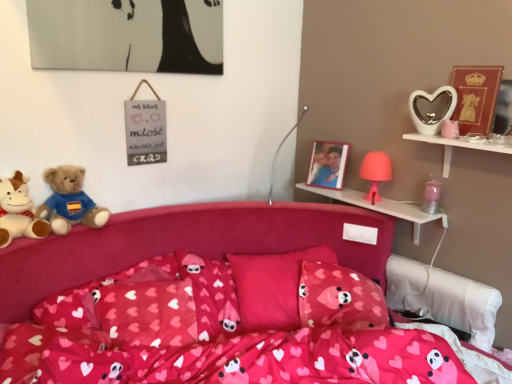
Question: Does matte gold picture frame at upper right, which is counted as the first picture frame, starting from the front, have a greater height compared to white glossy heart at upper right, the 3th toy ordered from the bottom?

Choices:
 (A) no
 (B) yes

Answer: (B)

Question: Could you tell me if matte gold picture frame at upper right, the first picture frame in the right-to-left sequence, is facing white glossy heart at upper right, the 3th toy ordered from the bottom?

Choices:
 (A) yes
 (B) no

Answer: (A)

Question: Would you say matte gold picture frame at upper right, arranged as the 2th picture frame when viewed from the left, contains white glossy heart at upper right, which is the second toy in top-to-bottom order?

Choices:
 (A) yes
 (B) no

Answer: (B)

Question: Is matte gold picture frame at upper right, arranged as the 2th picture frame when viewed from the left, located outside white glossy heart at upper right, the 3th toy ordered from the bottom?

Choices:
 (A) yes
 (B) no

Answer: (A)

Question: From the image's perspective, is matte gold picture frame at upper right, the first picture frame in the right-to-left sequence, on white glossy heart at upper right, the 3th toy ordered from the bottom?

Choices:
 (A) no
 (B) yes

Answer: (B)

Question: Does matte gold picture frame at upper right, arranged as the 2th picture frame when viewed from the left, have a lesser width compared to white glossy heart at upper right, the 3th toy ordered from the bottom?

Choices:
 (A) no
 (B) yes

Answer: (B)

Question: Does pink fabric bed at center appear on the right side of white glossy heart-shaped object at upper right, marked as the first shelf in a front-to-back arrangement?

Choices:
 (A) no
 (B) yes

Answer: (A)

Question: Is pink fabric bed at center at the left side of white glossy heart-shaped object at upper right, marked as the first shelf in a front-to-back arrangement?

Choices:
 (A) no
 (B) yes

Answer: (B)

Question: Is pink fabric bed at center facing towards white glossy heart-shaped object at upper right, marked as the first shelf in a front-to-back arrangement?

Choices:
 (A) yes
 (B) no

Answer: (B)

Question: Does pink fabric bed at center have a smaller size compared to white glossy heart-shaped object at upper right, which ranks as the 2th shelf in back-to-front order?

Choices:
 (A) yes
 (B) no

Answer: (B)

Question: Can you confirm if pink fabric bed at center is shorter than white glossy heart-shaped object at upper right, marked as the first shelf in a front-to-back arrangement?

Choices:
 (A) yes
 (B) no

Answer: (B)

Question: Would you say white glossy heart-shaped object at upper right, marked as the first shelf in a front-to-back arrangement, is part of pink fabric bed at center's contents?

Choices:
 (A) no
 (B) yes

Answer: (A)

Question: From a real-world perspective, does matte gold picture frame at upper right, which is counted as the first picture frame, starting from the front, sit lower than soft plush teddy bear at left, which is counted as the second teddy bear, starting from the right?

Choices:
 (A) yes
 (B) no

Answer: (B)